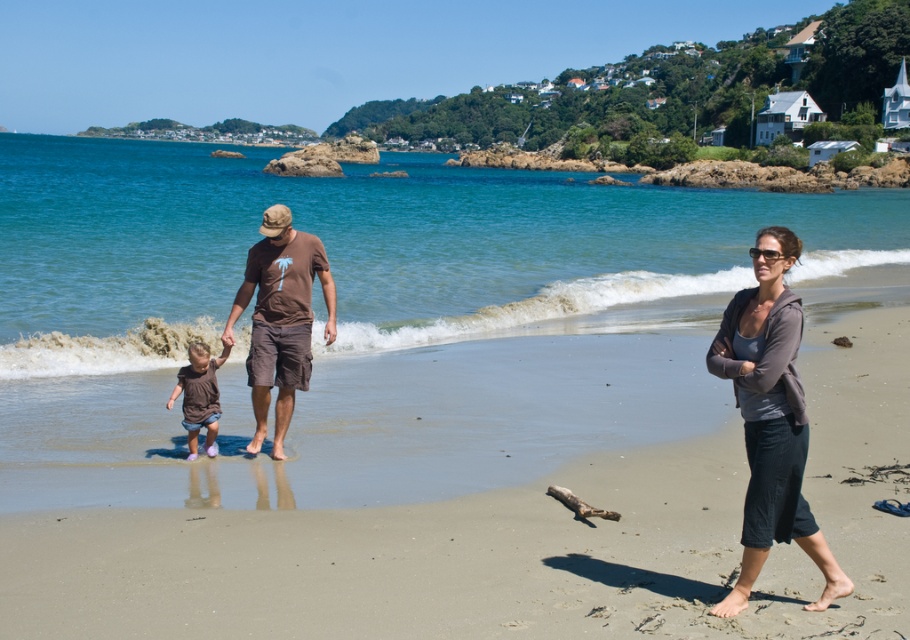
Question: Is smooth sand at center bigger than gray fleece jacket at right?

Choices:
 (A) no
 (B) yes

Answer: (B)

Question: Which point is closer to the camera taking this photo?

Choices:
 (A) (755, 460)
 (B) (413, 602)
 (C) (268, 250)
 (D) (187, 417)

Answer: (A)

Question: Which object appears farthest from the camera in this image?

Choices:
 (A) matte brown shorts at center
 (B) gray fleece jacket at right
 (C) smooth sand at center
 (D) brown cotton t-shirt at center

Answer: (D)

Question: Is smooth sand at center below gray fleece jacket at right?

Choices:
 (A) no
 (B) yes

Answer: (A)

Question: Which point is farther to the camera?

Choices:
 (A) gray fleece jacket at right
 (B) smooth sand at center

Answer: (A)

Question: From the image, what is the correct spatial relationship of smooth sand at center in relation to matte brown shorts at center?

Choices:
 (A) right
 (B) left

Answer: (A)